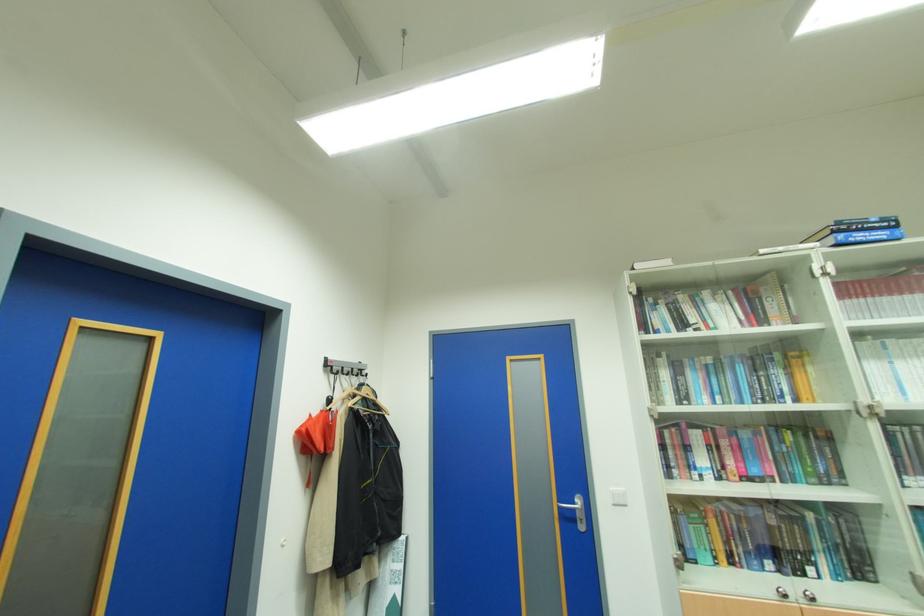
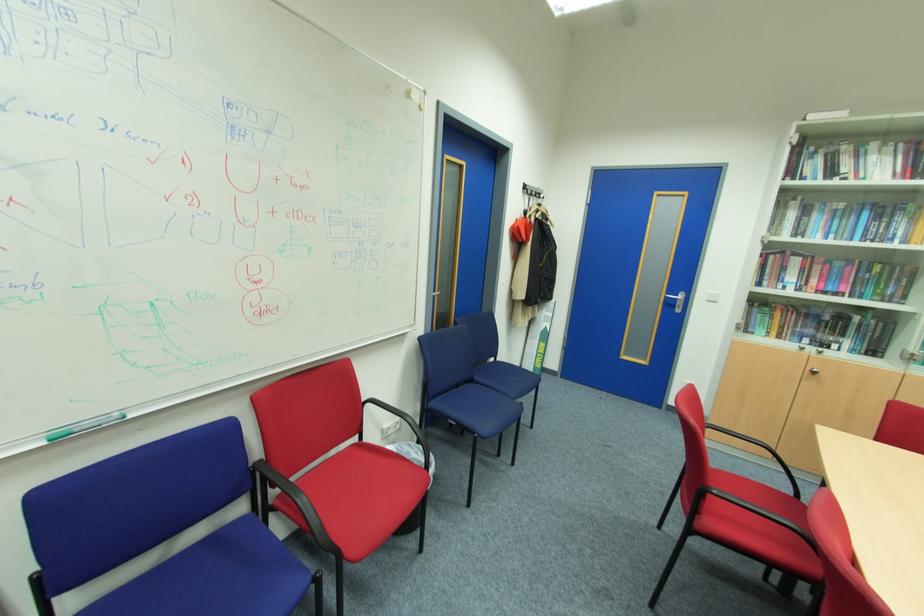
Where in the second image is the point corresponding to (x=617, y=505) from the first image?

(711, 301)